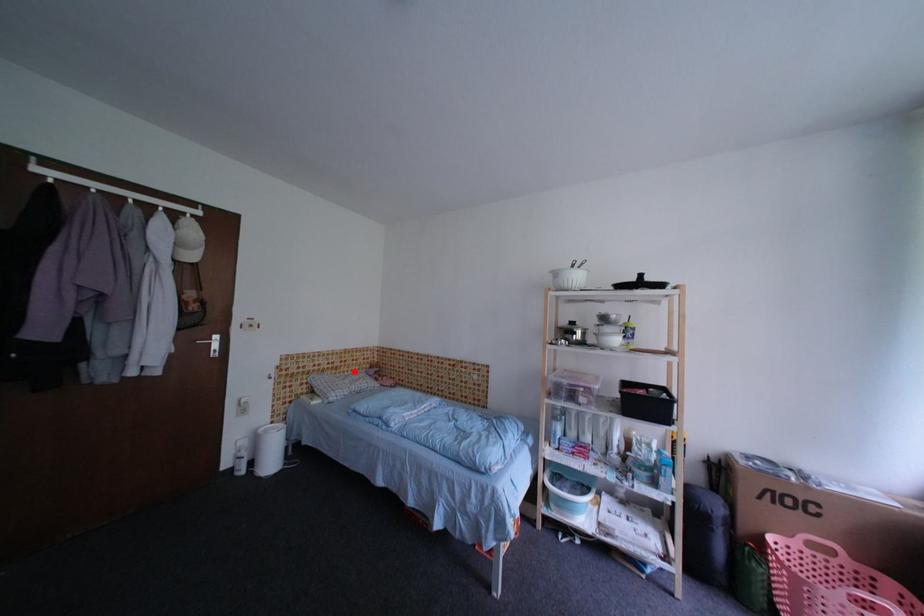
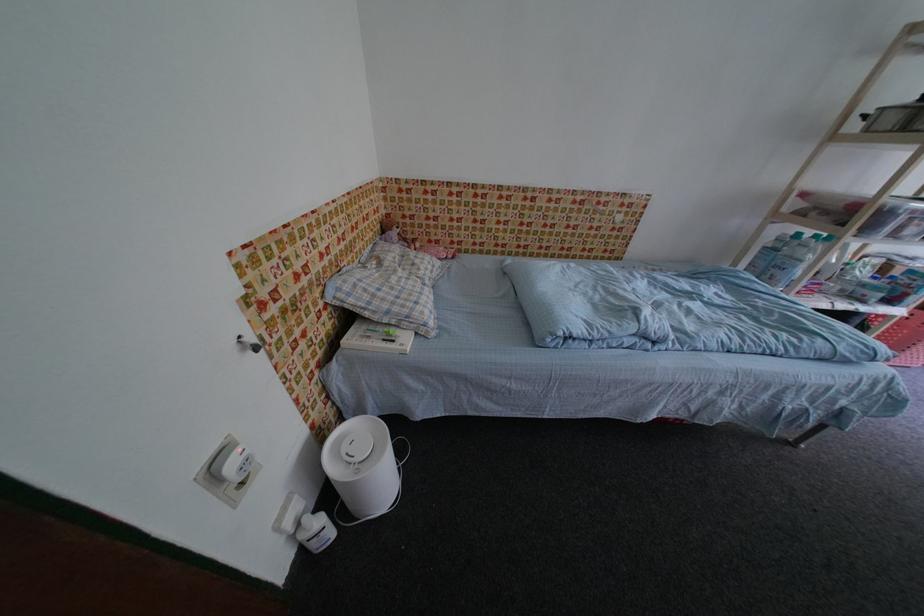
The point at the highlighted location is marked in the first image. Where is the corresponding point in the second image?

(370, 246)